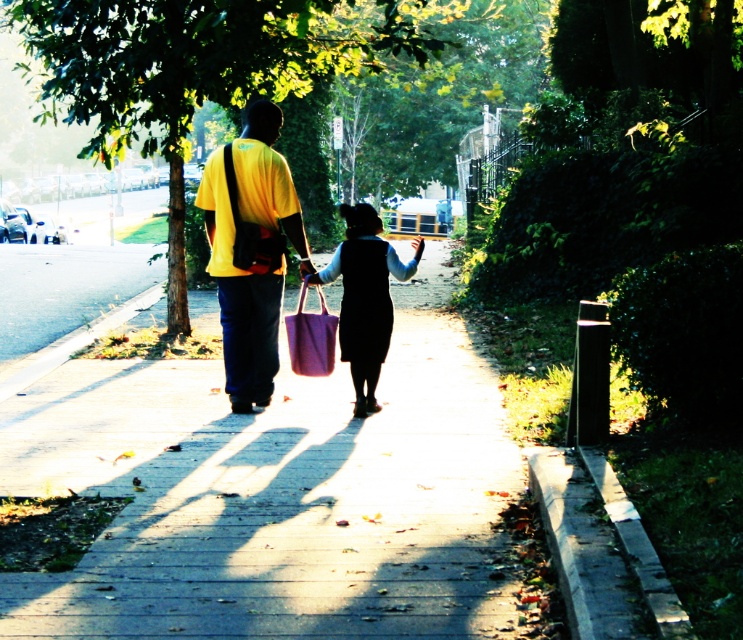
You are standing at the starting point of the smooth concrete sidewalk at center. If you walk straight ahead, will you eventually reach the two people walking on the sidewalk?

The smooth concrete sidewalk at center is located at point (276,496), so walking straight ahead along the sidewalk will lead you towards the two people since they are on the same path.

You are a photographer trying to capture a photo of the yellow matte shirt at center and the matte purple bag at center. If you want to ensure both are fully visible in your frame, which object should you focus on to account for their sizes?

The yellow matte shirt at center might be wider than the matte purple bag at center, so focusing on the yellow matte shirt at center ensures both are fully visible in the frame.

Based on the photo, you are a photographer standing behind the two people on the sidewalk. You want to take a photo that includes both the smooth concrete sidewalk at center and the yellow matte shirt at center. Which object should you focus on first to ensure it appears sharp in the photo?

The smooth concrete sidewalk at center is in front of the yellow matte shirt at center, so you should focus on the smooth concrete sidewalk at center first to ensure it appears sharp in the photo.